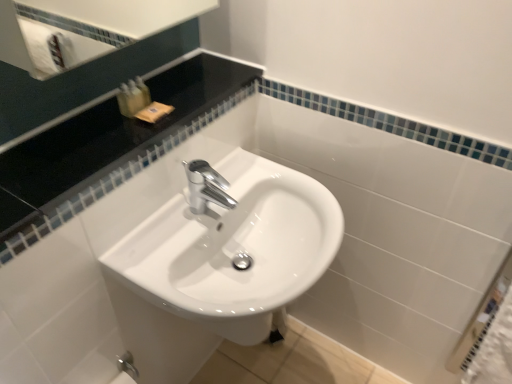
Question: Looking at their shapes, would you say black glossy countertop at upper left is wider or thinner than polished chrome tap at center?

Choices:
 (A) wide
 (B) thin

Answer: (A)

Question: Is black glossy countertop at upper left in front of or behind polished chrome tap at center in the image?

Choices:
 (A) front
 (B) behind

Answer: (A)

Question: Estimate the real-world distances between objects in this image. Which object is farther from the white glossy sink at center?

Choices:
 (A) polished chrome tap at center
 (B) black glossy countertop at upper left
 (C) translucent plastic soap at upper left, the 1th toiletry positioned from the left
 (D) translucent plastic soap dispenser at upper left, positioned as the 2th toiletry in right-to-left order
 (E) translucent plastic soap at upper left, which is the 1th toiletry in right-to-left order

Answer: (E)

Question: Which of these objects is positioned closest to the black glossy countertop at upper left?

Choices:
 (A) white glossy sink at center
 (B) translucent plastic soap dispenser at upper left, which is counted as the 2th toiletry, starting from the left
 (C) translucent plastic soap at upper left, the 1th toiletry positioned from the left
 (D) translucent plastic soap at upper left, which is counted as the third toiletry, starting from the left
 (E) polished chrome tap at center

Answer: (B)